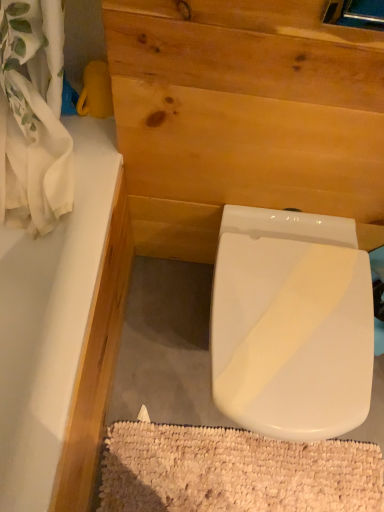
Question: Can you confirm if natural wood plywood at center is positioned to the right of white textured bath mat at lower center?

Choices:
 (A) no
 (B) yes

Answer: (B)

Question: Would you say natural wood plywood at center is a long distance from white textured bath mat at lower center?

Choices:
 (A) yes
 (B) no

Answer: (B)

Question: Is natural wood plywood at center to the left of white textured bath mat at lower center from the viewer's perspective?

Choices:
 (A) yes
 (B) no

Answer: (B)

Question: Can you confirm if natural wood plywood at center is wider than white textured bath mat at lower center?

Choices:
 (A) no
 (B) yes

Answer: (A)

Question: From the image's perspective, does natural wood plywood at center appear higher than white textured bath mat at lower center?

Choices:
 (A) no
 (B) yes

Answer: (B)

Question: Is white textured bath mat at lower center at the back of natural wood plywood at center?

Choices:
 (A) yes
 (B) no

Answer: (B)

Question: Is white glossy toilet at center not near white glossy bathtub at upper left?

Choices:
 (A) no
 (B) yes

Answer: (A)

Question: Is the surface of white glossy toilet at center in direct contact with white glossy bathtub at upper left?

Choices:
 (A) no
 (B) yes

Answer: (A)

Question: Is white glossy toilet at center positioned with its back to white glossy bathtub at upper left?

Choices:
 (A) no
 (B) yes

Answer: (A)

Question: Does white glossy toilet at center have a greater width compared to white glossy bathtub at upper left?

Choices:
 (A) no
 (B) yes

Answer: (B)

Question: Is white glossy toilet at center outside white glossy bathtub at upper left?

Choices:
 (A) yes
 (B) no

Answer: (A)

Question: Can you confirm if white glossy toilet at center is taller than white glossy bathtub at upper left?

Choices:
 (A) yes
 (B) no

Answer: (B)

Question: Could you tell me if white textured bath mat at lower center is turned towards natural wood plywood at center?

Choices:
 (A) yes
 (B) no

Answer: (B)